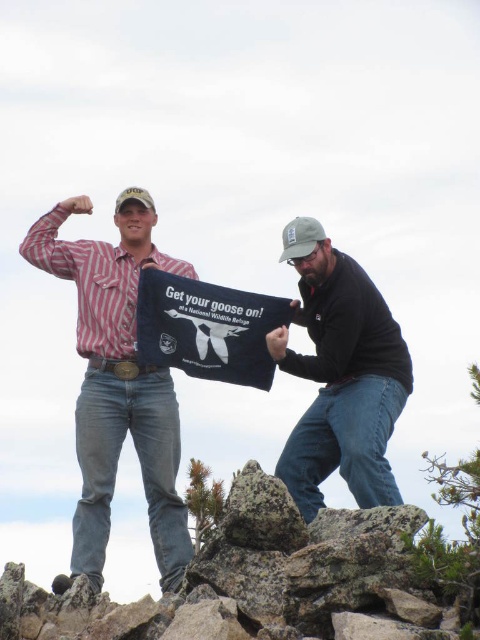
You are a hiker who has just reached the summit. You see two signs in front of you, the dark blue fabric sign at center and the black fabric sign at center. Which sign should you look at first if you want to read the one on the right side?

The dark blue fabric sign at center is to the right of the black fabric sign at center, so you should look at the dark blue fabric sign at center first if you want to read the one on the right side.

You are a photographer taking a picture of the two people in the scene. The matte red plaid shirt at center and the black fabric sign at center are both in the frame. Which object is positioned lower in the image?

The matte red plaid shirt at center is located below the black fabric sign at center, so it is positioned lower in the image.

You are a photographer capturing the scene of two people on a rocky mountain terrain. You notice the matte red plaid shirt at center and the black fabric sign at center. Which object would appear bigger in your photo?

The matte red plaid shirt at center has a larger size compared to the black fabric sign at center, so it would appear bigger in the photo.